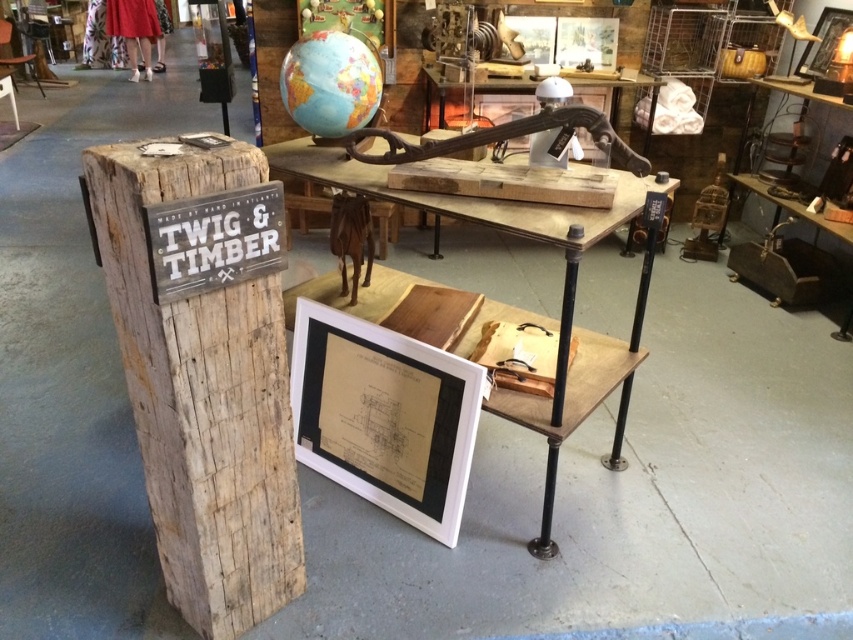
You are a delivery person who needs to place a package that is 3 feet long between the weathered wood sign at left and the blue and green globe at upper center. Can the package fit in the space between them?

The distance between the weathered wood sign at left and the blue and green globe at upper center is 36.37 inches. Since 3 feet equals 36 inches, the package can just barely fit in the space between them.

You are an interior designer planning to place a new decorative item in the space. You have a choice between the weathered wood sign at left and the blue and green globe at upper center. If you want to choose the larger item to dominate the visual focus, which one should you select?

The weathered wood sign at left is larger in size than the blue and green globe at upper center, so you should select the weathered wood sign at left to dominate the visual focus.